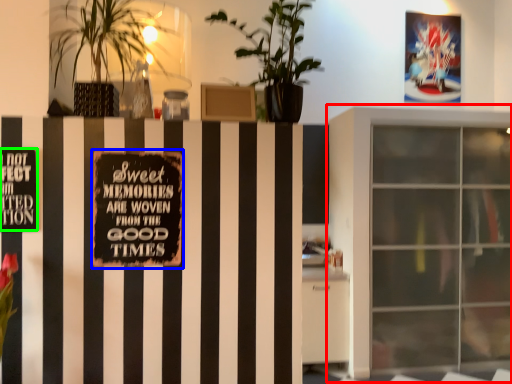
Question: Based on their relative distances, which object is farther from window (highlighted by a red box)? Choose from bulletin board (highlighted by a blue box) and warning sign (highlighted by a green box).

Choices:
 (A) bulletin board
 (B) warning sign

Answer: (B)